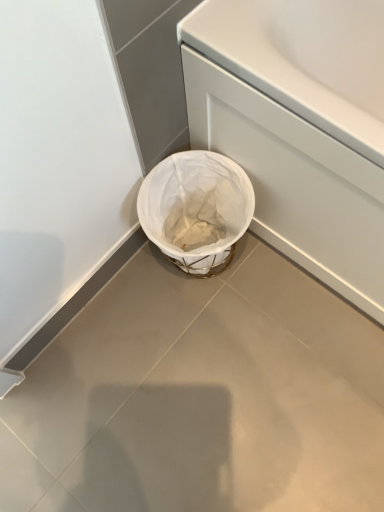
At what (x,y) coordinates should I click in order to perform the action: click on vacant area in front of white fabric basket at lower center. Please return your answer as a coordinate pair (x, y). Looking at the image, I should click on (207, 332).